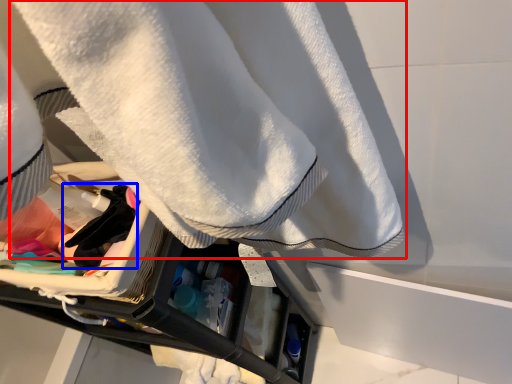
Question: Which object is further to the camera taking this photo, towel (highlighted by a red box) or clothing (highlighted by a blue box)?

Choices:
 (A) towel
 (B) clothing

Answer: (B)